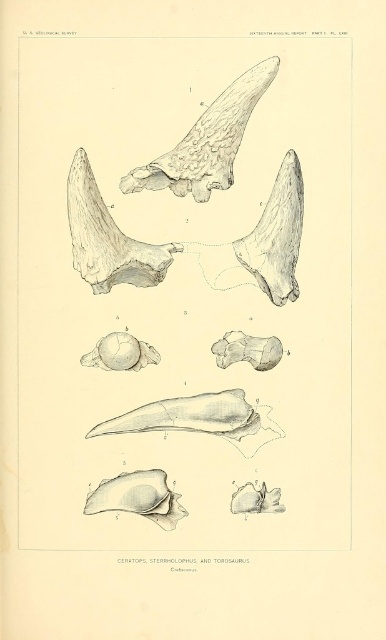
You are examining the fossil illustration labeled PL. LXIII. You notice two points marked in the image. The first point is at coordinates point (128,499) and the second is at point (99,352). From your observation, which point is nearer to you?

Point (128,499) is closer to the camera than point (99,352).